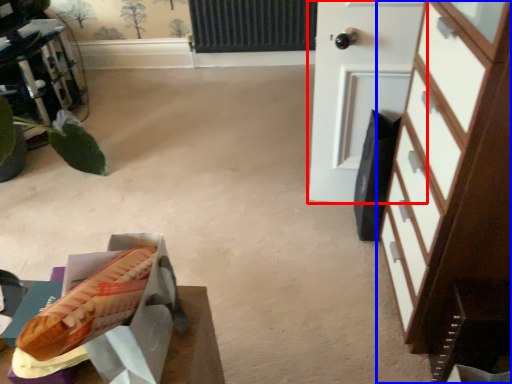
Question: Which object appears closest to the camera in this image, door (highlighted by a red box) or chest of drawers (highlighted by a blue box)?

Choices:
 (A) door
 (B) chest of drawers

Answer: (B)